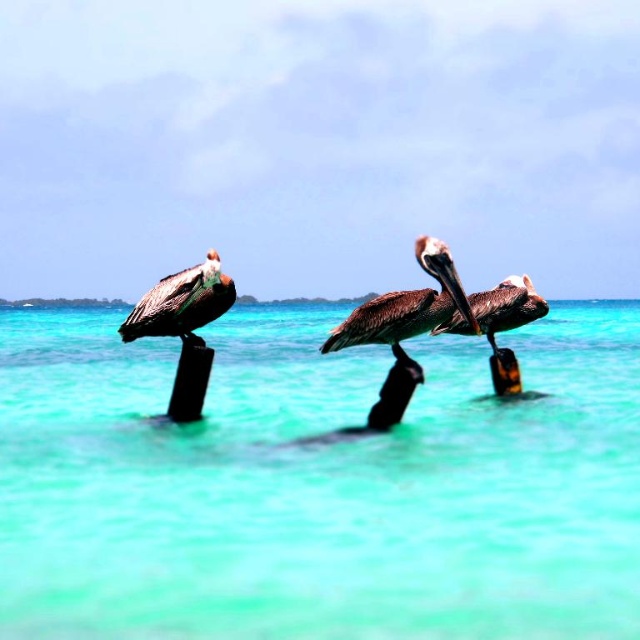
Question: Among these points, which one is farthest from the camera?

Choices:
 (A) (216, 627)
 (B) (492, 305)
 (C) (387, 342)

Answer: (B)

Question: Which object is farther from the camera taking this photo?

Choices:
 (A) turquoise water at center
 (B) brown feathered pelican at left
 (C) brown matte pelican at center

Answer: (C)

Question: Is brown feathered pelican at center thinner than brown feathered pelican at left?

Choices:
 (A) yes
 (B) no

Answer: (B)

Question: Can you confirm if brown feathered pelican at center is positioned to the right of brown feathered pelican at left?

Choices:
 (A) no
 (B) yes

Answer: (B)

Question: Is brown feathered pelican at left wider than brown matte pelican at center?

Choices:
 (A) no
 (B) yes

Answer: (A)

Question: Which object is positioned farthest from the brown feathered pelican at center?

Choices:
 (A) brown feathered pelican at left
 (B) turquoise water at center

Answer: (B)